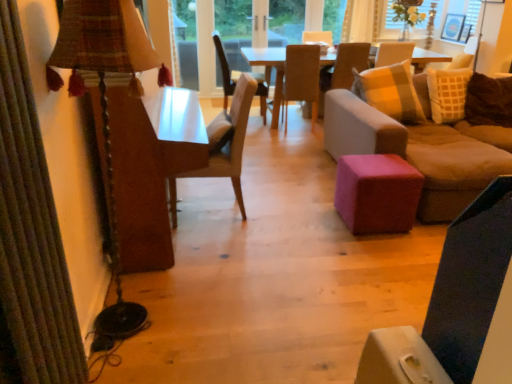
At what (x,y) coordinates should I click in order to perform the action: click on vacant space that's between wooden chair at center, placed as the first chair when sorted from front to back, and pink fabric ottoman at center. Please return your answer as a coordinate pair (x, y). The width and height of the screenshot is (512, 384). Looking at the image, I should click on (292, 212).